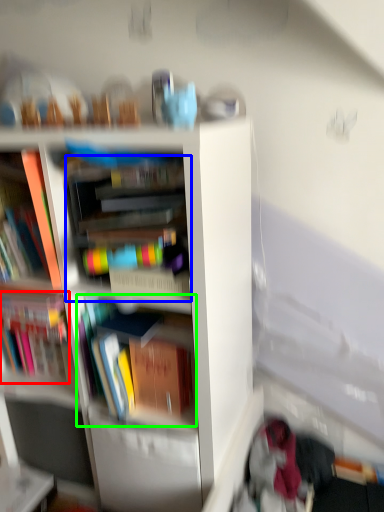
Question: Based on their relative distances, which object is nearer to book (highlighted by a red box)? Choose from book (highlighted by a blue box) and book (highlighted by a green box).

Choices:
 (A) book
 (B) book

Answer: (B)